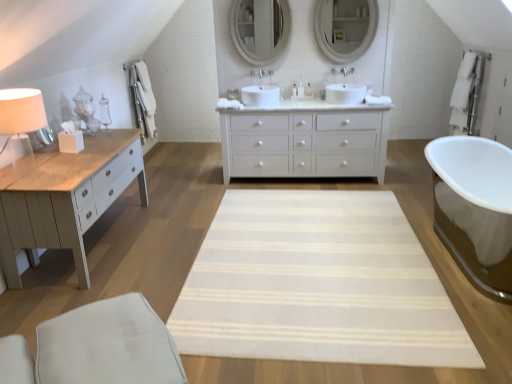
The width and height of the screenshot is (512, 384). In order to click on free space in front of white painted wood chest of drawers at center in this screenshot , I will do `click(297, 230)`.